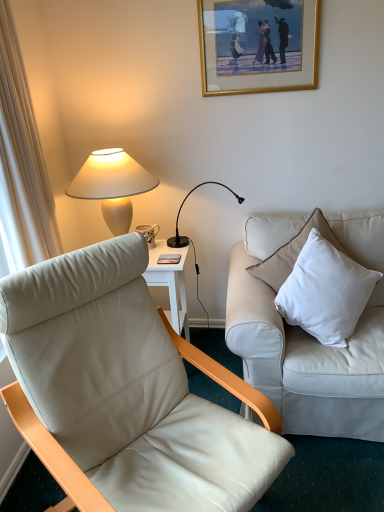
Measure the distance between point (61, 479) and camera.

The distance of point (61, 479) from camera is 3.93 feet.

You are a GUI agent. You are given a task and a screenshot of the screen. Output one action in this format:
    pyautogui.click(x=<x>, y=<y>)
    Task: Click on the white ceramic lamp at upper left, marked as the second lamp in a right-to-left arrangement
    
    Given the screenshot: What is the action you would take?
    pyautogui.click(x=112, y=185)

The height and width of the screenshot is (512, 384). Describe the element at coordinates (112, 185) in the screenshot. I see `white ceramic lamp at upper left, arranged as the 1th lamp when viewed from the left` at that location.

The width and height of the screenshot is (384, 512). Describe the element at coordinates (310, 335) in the screenshot. I see `white leather couch at right` at that location.

The height and width of the screenshot is (512, 384). What do you see at coordinates (325, 291) in the screenshot? I see `white cotton pillow at right` at bounding box center [325, 291].

What is the approximate height of white cotton pillow at right?

white cotton pillow at right is 16.66 inches tall.

Image resolution: width=384 pixels, height=512 pixels. What do you see at coordinates (191, 239) in the screenshot? I see `black metal/texture desk lamp at upper center, which ranks as the 2th lamp in left-to-right order` at bounding box center [191, 239].

I want to click on leather chair at left, so click(x=124, y=391).

Can you confirm if white leather couch at right is positioned to the left of white ceramic lamp at upper left, arranged as the 1th lamp when viewed from the left?

No.

Is white leather couch at right thinner than white ceramic lamp at upper left, arranged as the 1th lamp when viewed from the left?

Yes, white leather couch at right is thinner than white ceramic lamp at upper left, arranged as the 1th lamp when viewed from the left.

Is white leather couch at right looking in the opposite direction of white ceramic lamp at upper left, arranged as the 1th lamp when viewed from the left?

No.

Is matte ceramic mug at upper center facing towards black metal/texture desk lamp at upper center, the first lamp from the right?

No, matte ceramic mug at upper center is not turned towards black metal/texture desk lamp at upper center, the first lamp from the right.

From a real-world perspective, count 1st lamps upward from the matte ceramic mug at upper center and point to it. Please provide its 2D coordinates.

[(191, 239)]

How many degrees apart are the facing directions of matte ceramic mug at upper center and black metal/texture desk lamp at upper center, which ranks as the 2th lamp in left-to-right order?

There is a 67.3-degree angle between the facing directions of matte ceramic mug at upper center and black metal/texture desk lamp at upper center, which ranks as the 2th lamp in left-to-right order.

How far apart are matte ceramic mug at upper center and black metal/texture desk lamp at upper center, the first lamp from the right?

matte ceramic mug at upper center and black metal/texture desk lamp at upper center, the first lamp from the right, are 18.54 centimeters apart.

Which of these two, white leather couch at right or black metal/texture desk lamp at upper center, which ranks as the 2th lamp in left-to-right order, stands taller?

white leather couch at right is taller.

Can you confirm if white leather couch at right is wider than black metal/texture desk lamp at upper center, which ranks as the 2th lamp in left-to-right order?

No, white leather couch at right is not wider than black metal/texture desk lamp at upper center, which ranks as the 2th lamp in left-to-right order.

Could you tell me if white leather couch at right is facing black metal/texture desk lamp at upper center, which ranks as the 2th lamp in left-to-right order?

No, white leather couch at right is not oriented towards black metal/texture desk lamp at upper center, which ranks as the 2th lamp in left-to-right order.

From the image's perspective, is leather chair at left positioned above or below white leather couch at right?

Based on their image positions, leather chair at left is located beneath white leather couch at right.

Is point (122, 408) closer to camera compared to point (345, 401)?

Yes.

From a real-world perspective, between leather chair at left and white leather couch at right, who is vertically lower?

leather chair at left.

Is leather chair at left closer to the viewer compared to white leather couch at right?

Yes, leather chair at left is closer to the camera.

Is gold-framed picture at upper center to the right of leather chair at left from the viewer's perspective?

Correct, you'll find gold-framed picture at upper center to the right of leather chair at left.

Is leather chair at left completely or partially inside gold-framed picture at upper center?

No, leather chair at left is not inside gold-framed picture at upper center.

Is gold-framed picture at upper center oriented towards leather chair at left?

No, gold-framed picture at upper center is not turned towards leather chair at left.

Is point (240, 39) behind point (6, 292)?

Yes, it is behind point (6, 292).

Is white cotton pillow at right with leather chair at left?

white cotton pillow at right and leather chair at left are clearly separated.

Considering the relative positions of white cotton pillow at right and leather chair at left in the image provided, is white cotton pillow at right to the right of leather chair at left from the viewer's perspective?

Yes, white cotton pillow at right is to the right of leather chair at left.

Consider the image. Would you say white cotton pillow at right is inside or outside leather chair at left?

white cotton pillow at right is not inside leather chair at left, it's outside.

Considering the sizes of white cotton pillow at right and leather chair at left in the image, is white cotton pillow at right wider or thinner than leather chair at left?

Considering their sizes, white cotton pillow at right looks slimmer than leather chair at left.

Does matte ceramic mug at upper center contain leather chair at left?

No, leather chair at left is not a part of matte ceramic mug at upper center.

Is matte ceramic mug at upper center positioned with its back to leather chair at left?

No, matte ceramic mug at upper center is not facing away from leather chair at left.

Considering the positions of objects matte ceramic mug at upper center and leather chair at left in the image provided, who is more to the right, matte ceramic mug at upper center or leather chair at left?

Positioned to the right is leather chair at left.

Locate an element on the screen. Image resolution: width=384 pixels, height=512 pixels. chair on the right of matte ceramic mug at upper center is located at coordinates (124, 391).

From the white leather couch at right, count the 2nd lamp to the left and point to it. Please provide its 2D coordinates.

[(112, 185)]

The width and height of the screenshot is (384, 512). What are the coordinates of `lamp on the right side of matte ceramic mug at upper center` in the screenshot? It's located at (191, 239).

From the image, which object appears to be nearer to white leather couch at right, matte ceramic mug at upper center or gold-framed picture at upper center?

matte ceramic mug at upper center.

Which object lies further to the anchor point leather chair at left, gold-framed picture at upper center or black metal/texture desk lamp at upper center, the first lamp from the right?

Based on the image, gold-framed picture at upper center appears to be further to leather chair at left.

Which object lies further to the anchor point white ceramic lamp at upper left, marked as the second lamp in a right-to-left arrangement, black metal/texture desk lamp at upper center, the first lamp from the right, or white leather couch at right?

The object further to white ceramic lamp at upper left, marked as the second lamp in a right-to-left arrangement, is white leather couch at right.

Looking at the image, which one is located closer to gold-framed picture at upper center, leather chair at left or white leather couch at right?

white leather couch at right is closer to gold-framed picture at upper center.

Consider the image. From the image, which object appears to be farther from white ceramic lamp at upper left, marked as the second lamp in a right-to-left arrangement, gold-framed picture at upper center or white leather couch at right?

white leather couch at right is further to white ceramic lamp at upper left, marked as the second lamp in a right-to-left arrangement.

Which object lies further to the anchor point white ceramic lamp at upper left, arranged as the 1th lamp when viewed from the left, gold-framed picture at upper center or matte ceramic mug at upper center?

gold-framed picture at upper center lies further to white ceramic lamp at upper left, arranged as the 1th lamp when viewed from the left, than the other object.

Considering their positions, is matte ceramic mug at upper center positioned closer to white ceramic lamp at upper left, arranged as the 1th lamp when viewed from the left, than white cotton pillow at right?

Based on the image, matte ceramic mug at upper center appears to be nearer to white ceramic lamp at upper left, arranged as the 1th lamp when viewed from the left.

Estimate the real-world distances between objects in this image. Which object is closer to white cotton pillow at right, leather chair at left or black metal/texture desk lamp at upper center, which ranks as the 2th lamp in left-to-right order?

leather chair at left.

This screenshot has width=384, height=512. Identify the location of coffee cup located between white ceramic lamp at upper left, marked as the second lamp in a right-to-left arrangement, and black metal/texture desk lamp at upper center, which ranks as the 2th lamp in left-to-right order, in the left-right direction. (149, 233).

Where is `lamp between gold-framed picture at upper center and black metal/texture desk lamp at upper center, which ranks as the 2th lamp in left-to-right order, in the vertical direction`? The width and height of the screenshot is (384, 512). lamp between gold-framed picture at upper center and black metal/texture desk lamp at upper center, which ranks as the 2th lamp in left-to-right order, in the vertical direction is located at coordinates (112, 185).

Find the location of `picture frame positioned between leather chair at left and matte ceramic mug at upper center from near to far`. picture frame positioned between leather chair at left and matte ceramic mug at upper center from near to far is located at coordinates (258, 45).

Find the location of a particular element. coffee cup between gold-framed picture at upper center and white cotton pillow at right from top to bottom is located at coordinates (149, 233).